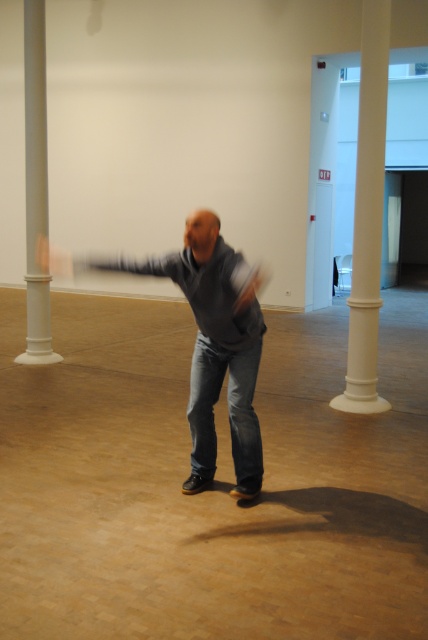
Question: Which of these objects is positioned farthest from the matte gray hand at upper left?

Choices:
 (A) matte black hand at center
 (B) white smooth column at left
 (C) white smooth column at right

Answer: (C)

Question: Among these points, which one is farthest from the camera?

Choices:
 (A) coord(35,337)
 (B) coord(249,292)
 (C) coord(235,376)
 (D) coord(359,225)

Answer: (A)

Question: Does white smooth column at left lie in front of matte black hand at center?

Choices:
 (A) no
 (B) yes

Answer: (A)

Question: Does white smooth column at left appear over smooth gray arm at center?

Choices:
 (A) no
 (B) yes

Answer: (B)

Question: Can you confirm if denim jeans at center is wider than matte black hand at center?

Choices:
 (A) no
 (B) yes

Answer: (B)

Question: Estimate the real-world distances between objects in this image. Which object is closer to the white smooth column at right?

Choices:
 (A) gray matte sweater at center
 (B) smooth gray arm at center

Answer: (A)